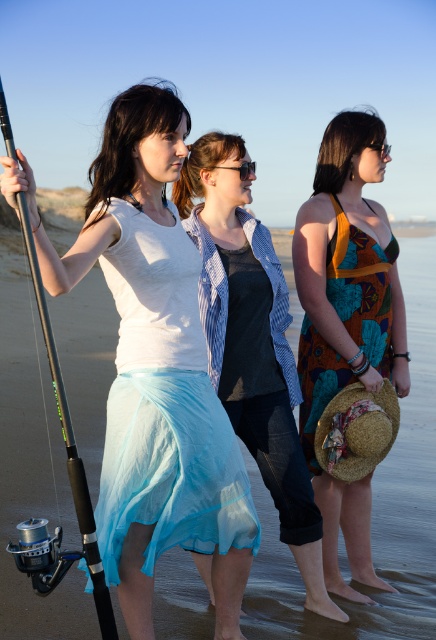
Which is below, translucent blue skirt at center or blue sheer skirt at center?

translucent blue skirt at center is lower down.

Is translucent blue skirt at center positioned before blue sheer skirt at center?

Yes, translucent blue skirt at center is closer to the viewer.

Which is behind, point (190, 353) or point (211, 324)?

The point (211, 324) is more distant.

At what (x,y) coordinates should I click in order to perform the action: click on translucent blue skirt at center. Please return your answer as a coordinate pair (x, y). The width and height of the screenshot is (436, 640). Looking at the image, I should click on (164, 406).

Is floral print dress at center behind multicolored printed fabric dress at center?

No, floral print dress at center is closer to the viewer.

Does floral print dress at center appear on the left side of multicolored printed fabric dress at center?

Correct, you'll find floral print dress at center to the left of multicolored printed fabric dress at center.

What do you see at coordinates (347, 321) in the screenshot? Image resolution: width=436 pixels, height=640 pixels. I see `floral print dress at center` at bounding box center [347, 321].

Where is `floral print dress at center`? floral print dress at center is located at coordinates (347, 321).

Which is in front, point (143, 310) or point (115, 632)?

Point (115, 632)

Between matte white blouse at center and silver metallic fishing pole at left, which one appears on the left side from the viewer's perspective?

From the viewer's perspective, silver metallic fishing pole at left appears more on the left side.

I want to click on matte white blouse at center, so click(x=153, y=365).

Locate an element on the screen. The height and width of the screenshot is (640, 436). matte white blouse at center is located at coordinates (153, 365).